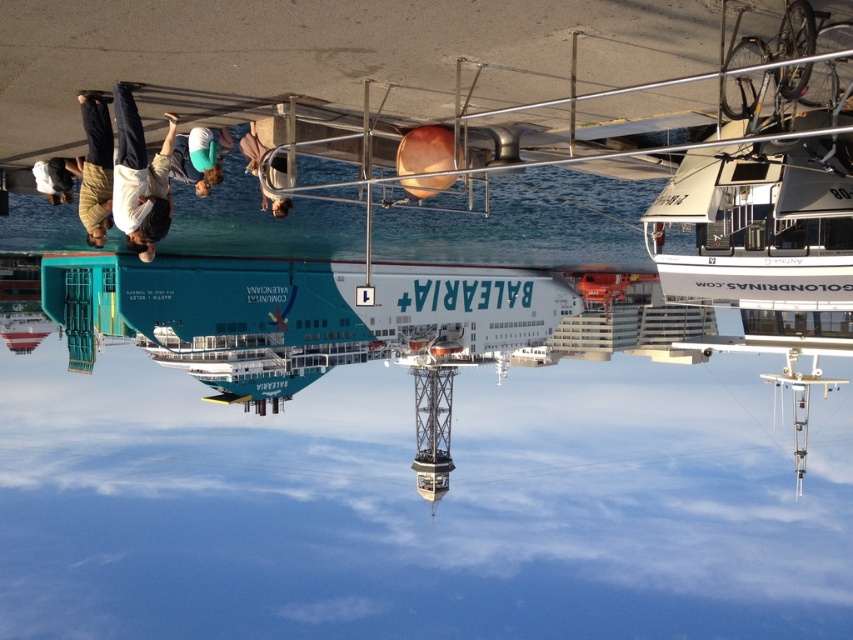
Question: Does white glossy boat at upper right have a lesser width compared to green fabric shirt at center?

Choices:
 (A) no
 (B) yes

Answer: (A)

Question: Based on their relative distances, which object is nearer to the green fabric shirt at center?

Choices:
 (A) brown leather jacket at upper left
 (B) white glossy boat at upper right

Answer: (A)

Question: Observing the image, what is the correct spatial positioning of brown leather jacket at upper left in reference to green fabric shirt at center?

Choices:
 (A) below
 (B) above

Answer: (A)

Question: Considering the real-world distances, which object is farthest from the green fabric shirt at center?

Choices:
 (A) white glossy boat at upper right
 (B) white cotton shirt at upper center
 (C) brown leather jacket at upper left
 (D) light brown shirt at upper left

Answer: (A)

Question: Can you confirm if green fabric shirt at center is bigger than white cotton shirt at upper center?

Choices:
 (A) yes
 (B) no

Answer: (B)

Question: Which object is farther from the camera taking this photo?

Choices:
 (A) white cotton shirt at upper center
 (B) brown leather jacket at upper left
 (C) green fabric shirt at center

Answer: (A)